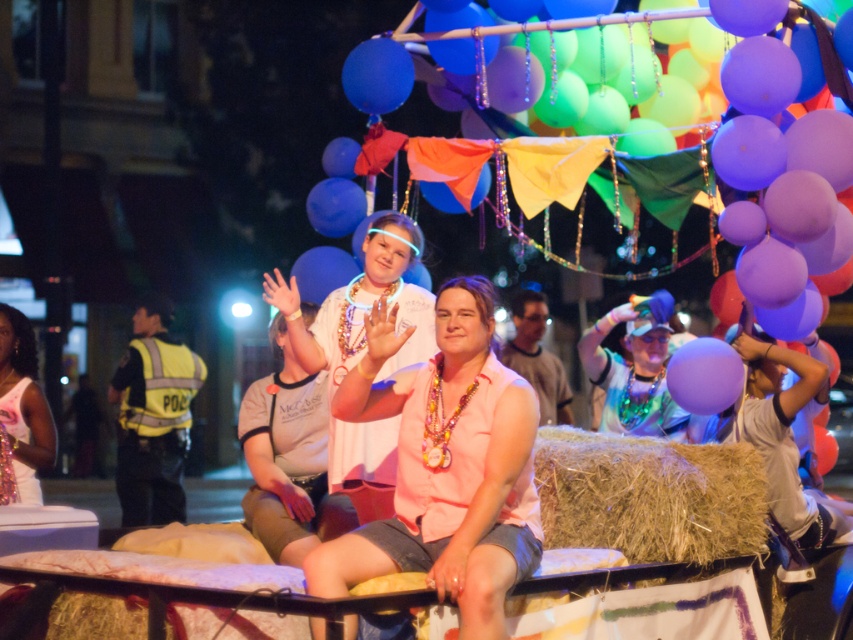
Question: Is yellow reflective vest at left to the left of purple matte balloon at center from the viewer's perspective?

Choices:
 (A) no
 (B) yes

Answer: (B)

Question: Which point appears closest to the camera in this image?

Choices:
 (A) (368, 570)
 (B) (686, 397)

Answer: (A)

Question: Where is yellow reflective vest at left located in relation to purple matte balloon at center in the image?

Choices:
 (A) above
 (B) below

Answer: (B)

Question: Is pink matte shirt at center positioned at the back of blue glossy balloon at upper center?

Choices:
 (A) yes
 (B) no

Answer: (B)

Question: Which of the following is the farthest from the observer?

Choices:
 (A) blue glossy balloon at upper center
 (B) pink matte shirt at center
 (C) brown straw bale at center

Answer: (A)

Question: Which object appears closest to the camera in this image?

Choices:
 (A) blue glossy balloon at upper center
 (B) purple matte balloon at center

Answer: (B)